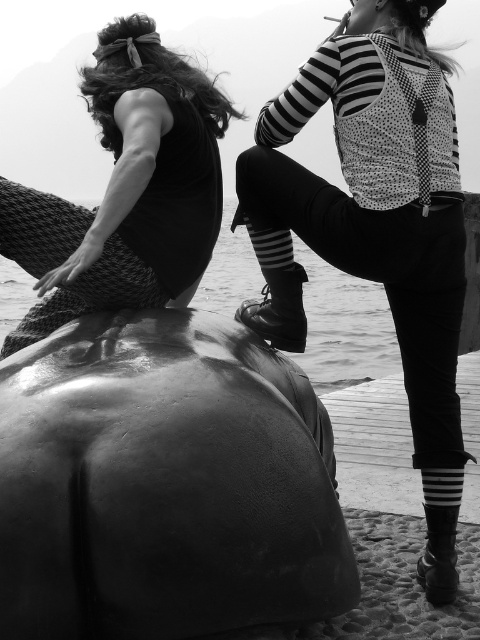
Question: Can you confirm if matte black dress at left is smaller than glossy water at center?

Choices:
 (A) yes
 (B) no

Answer: (A)

Question: Which object is positioned farthest from the polka dot fabric backpack at upper right?

Choices:
 (A) glossy water at center
 (B) matte black dress at left

Answer: (A)

Question: Where is shiny dark gray humpback whale at lower left located in relation to glossy water at center in the image?

Choices:
 (A) below
 (B) above

Answer: (A)

Question: Among these points, which one is farthest from the camera?

Choices:
 (A) (315, 385)
 (B) (242, 333)
 (C) (127, 67)
 (D) (283, 157)

Answer: (A)

Question: Which point is farther from the camera taking this photo?

Choices:
 (A) (67, 292)
 (B) (324, 326)

Answer: (B)

Question: Is shiny dark gray humpback whale at lower left positioned at the back of matte black dress at left?

Choices:
 (A) no
 (B) yes

Answer: (A)